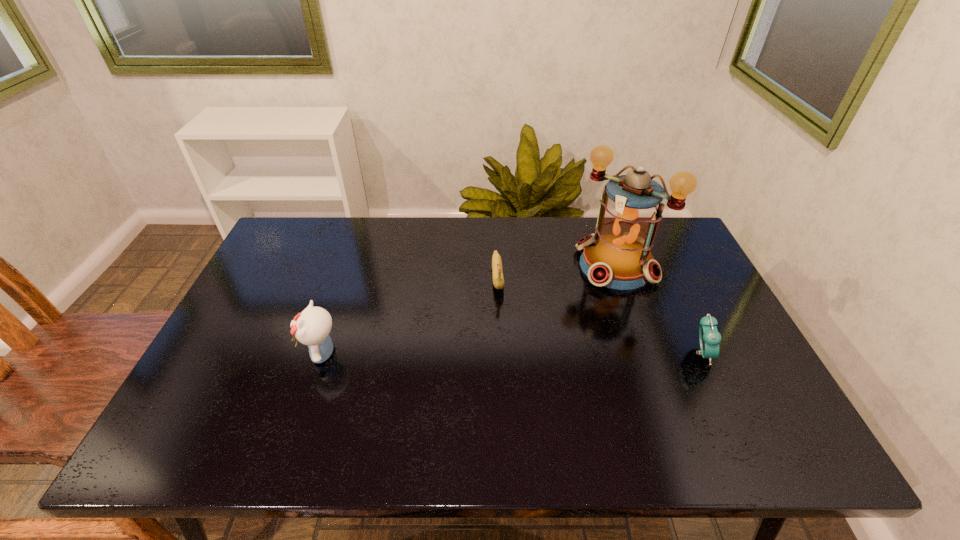
The height and width of the screenshot is (540, 960). What are the coordinates of `the third shortest object` in the screenshot? It's located at (312, 327).

Where is `kitten`? The width and height of the screenshot is (960, 540). kitten is located at coordinates (312, 327).

Where is `alarm clock`? This screenshot has height=540, width=960. alarm clock is located at coordinates (710, 338).

The image size is (960, 540). Identify the location of the tallest object. (617, 256).

The height and width of the screenshot is (540, 960). I want to click on the second object from left to right, so click(498, 280).

At what (x,y) coordinates should I click in order to perform the action: click on vacant point located 0.140m on the front-facing side of the leftmost object. Please return your answer as a coordinate pair (x, y). This screenshot has height=540, width=960. Looking at the image, I should click on (250, 353).

The image size is (960, 540). What are the coordinates of `vacant space positioned on the front-facing side of the leftmost object` in the screenshot? It's located at (270, 353).

In order to click on free spot located on the front-facing side of the leftmost object in this screenshot , I will do `click(274, 353)`.

You are a GUI agent. You are given a task and a screenshot of the screen. Output one action in this format:
    pyautogui.click(x=<x>, y=<y>)
    Task: Click on the vacant space situated on the front-facing side of the tallest object
    The height and width of the screenshot is (540, 960).
    Given the screenshot: What is the action you would take?
    pyautogui.click(x=564, y=319)

Find the location of a particular element. This screenshot has height=540, width=960. free space located on the front-facing side of the tallest object is located at coordinates (519, 365).